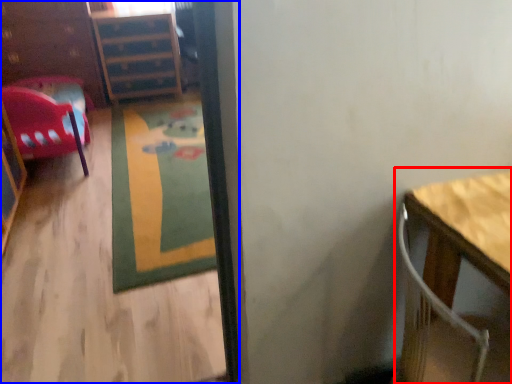
Question: Which point is further to the camera, table (highlighted by a red box) or corridor (highlighted by a blue box)?

Choices:
 (A) table
 (B) corridor

Answer: (A)